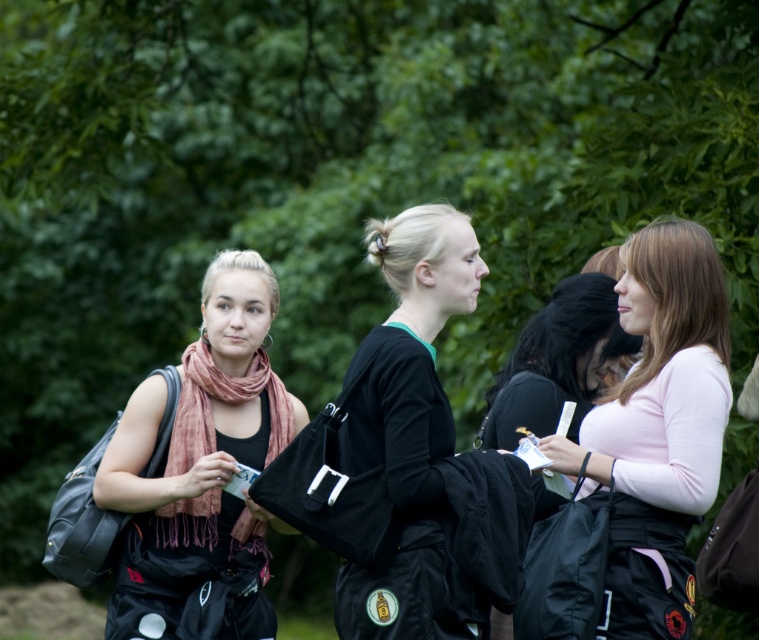
Question: Does pink matte shirt at right come in front of black matte jacket at center?

Choices:
 (A) no
 (B) yes

Answer: (A)

Question: Which point is closer to the camera taking this photo?

Choices:
 (A) (225, 547)
 (B) (641, 330)
 (C) (194, 403)
 (D) (484, 436)

Answer: (B)

Question: Can you confirm if pink matte shirt at right is positioned below black matte jacket at center?

Choices:
 (A) yes
 (B) no

Answer: (A)

Question: Does pink matte shirt at right have a smaller size compared to soft pink scarf at left?

Choices:
 (A) yes
 (B) no

Answer: (B)

Question: Among these objects, which one is farthest from the camera?

Choices:
 (A) pink matte shirt at right
 (B) matte black jacket at right

Answer: (B)

Question: Estimate the real-world distances between objects in this image. Which object is closer to the pink matte shirt at right?

Choices:
 (A) matte black jacket at right
 (B) matte black jacket at left
 (C) soft pink scarf at left
 (D) black matte jacket at center

Answer: (D)